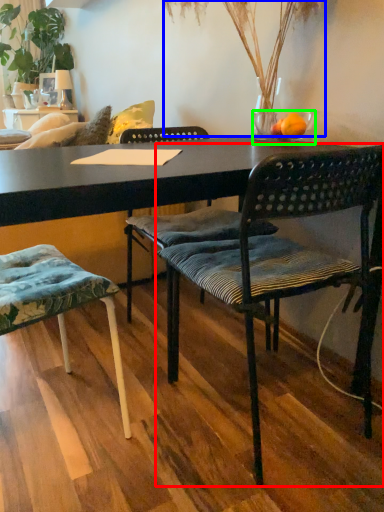
Question: Which object is positioned farthest from chair (highlighted by a red box)? Select from plant (highlighted by a blue box) and bowl (highlighted by a green box).

Choices:
 (A) plant
 (B) bowl

Answer: (A)